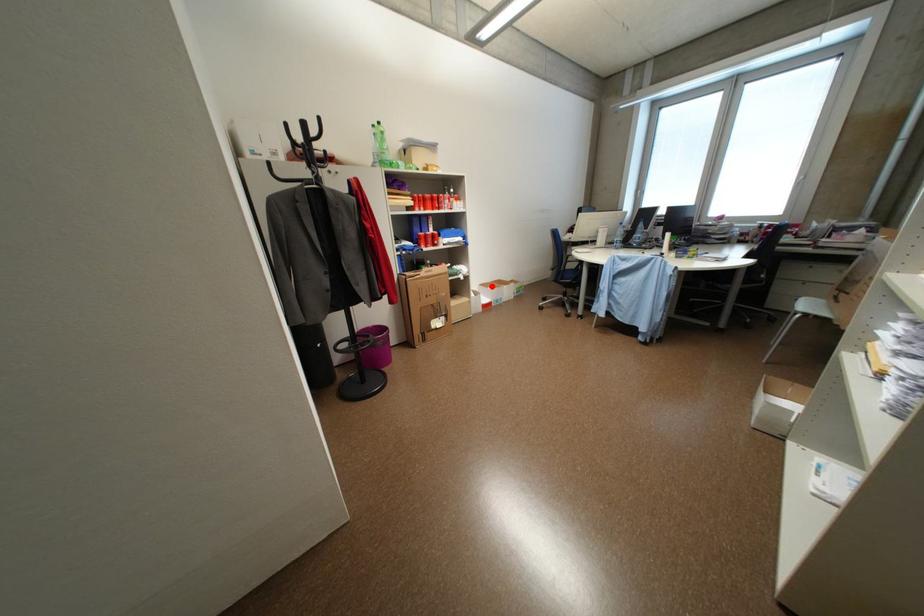
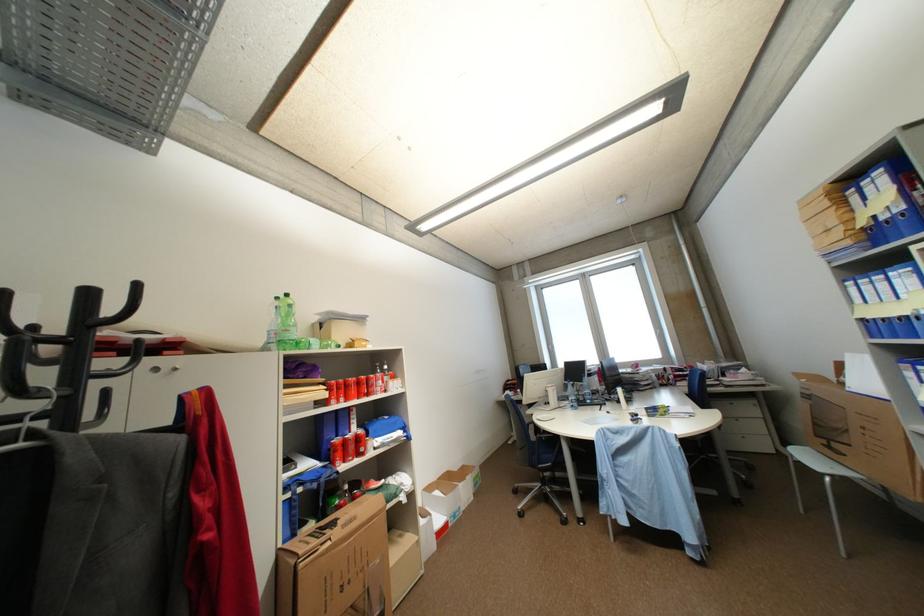
Locate, in the second image, the point that corresponds to the highlighted location in the first image.

(438, 490)